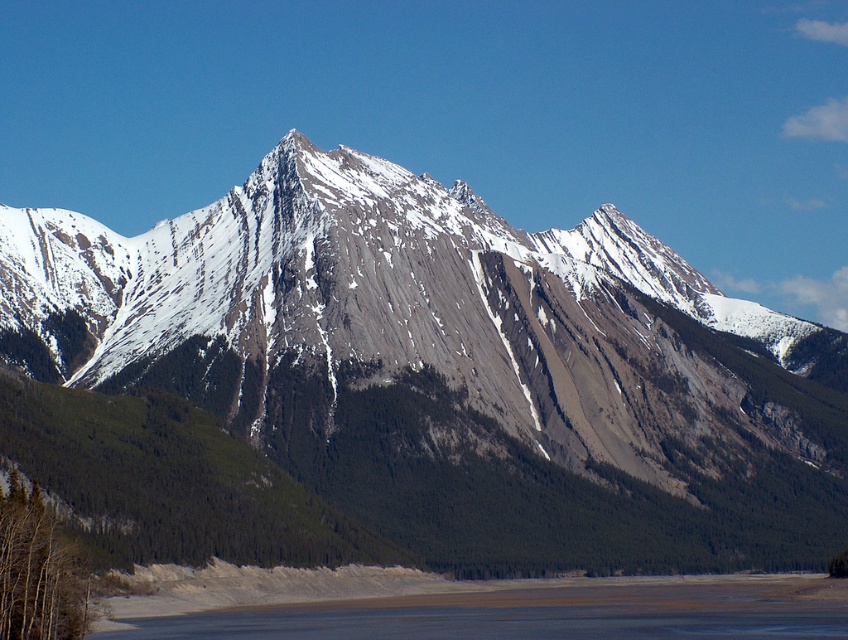
Question: Which of the following is the farthest from the observer?

Choices:
 (A) (495, 448)
 (B) (768, 582)

Answer: (B)

Question: From the image, what is the correct spatial relationship of gray rocky mountain at center in relation to brown sand at lower center?

Choices:
 (A) above
 (B) below

Answer: (A)

Question: Is gray rocky mountain at center to the left of brown sand at lower center from the viewer's perspective?

Choices:
 (A) yes
 (B) no

Answer: (A)

Question: Does gray rocky mountain at center have a smaller size compared to brown sand at lower center?

Choices:
 (A) no
 (B) yes

Answer: (A)

Question: Which point appears farthest from the camera in this image?

Choices:
 (A) (701, 369)
 (B) (294, 620)

Answer: (A)